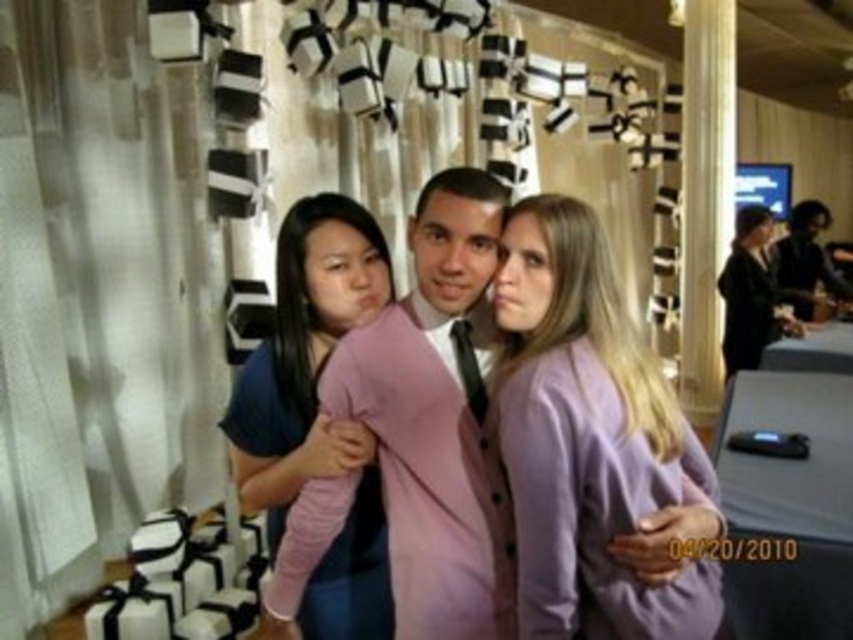
Consider the image. You are organizing a charity event and need to ensure that all donated clothing items fit into a display case. The display case has a height limit of 1 meter. You have two items to place inside the case, the purple fabric shirt at center and the pink matte sweater at center. Given their sizes, which item is more likely to fit within the height constraints of the display case?

The purple fabric shirt at center has a smaller size compared to the pink matte sweater at center, so the purple fabric shirt at center is more likely to fit within the height constraints of the display case.